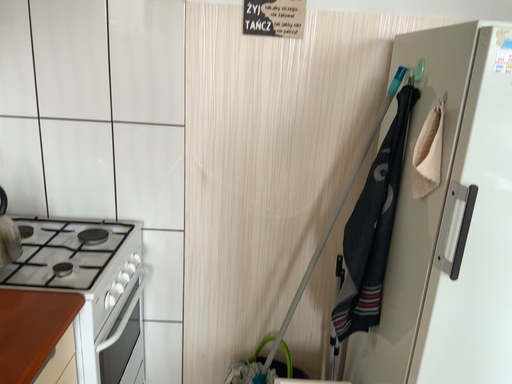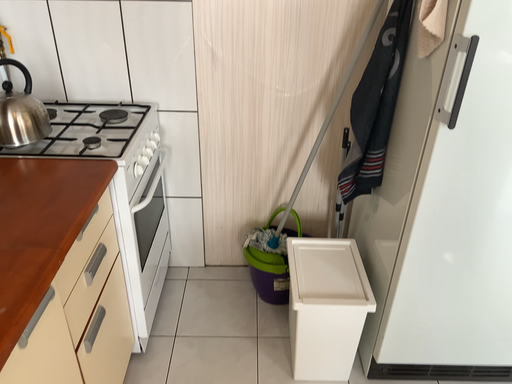
Question: How did the camera likely rotate when shooting the video?

Choices:
 (A) rotated downward
 (B) rotated upward

Answer: (A)